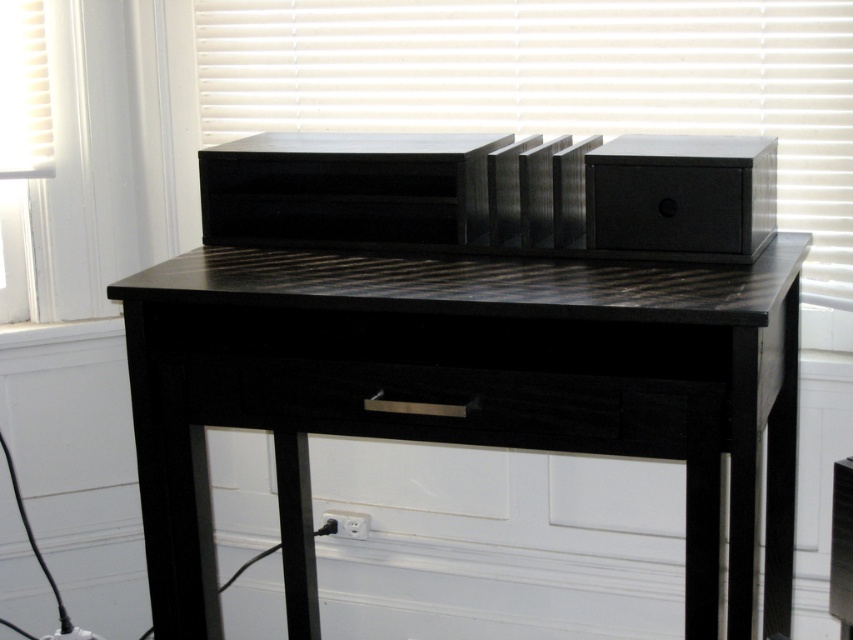
Question: Which is nearer to the black wood table at center?

Choices:
 (A) black matte drawer at center
 (B) matte black speaker at upper center

Answer: (A)

Question: Is black wood table at center further to camera compared to matte black speaker at upper center?

Choices:
 (A) yes
 (B) no

Answer: (B)

Question: Which object appears farthest from the camera in this image?

Choices:
 (A) black matte drawer at center
 (B) black wood table at center

Answer: (A)

Question: Which point is closer to the camera?

Choices:
 (A) (625, 33)
 (B) (711, 541)

Answer: (B)

Question: Can you confirm if matte black speaker at upper center is bigger than black matte drawer at center?

Choices:
 (A) no
 (B) yes

Answer: (B)

Question: Considering the relative positions of matte black speaker at upper center and black matte drawer at center in the image provided, where is matte black speaker at upper center located with respect to black matte drawer at center?

Choices:
 (A) right
 (B) left

Answer: (A)